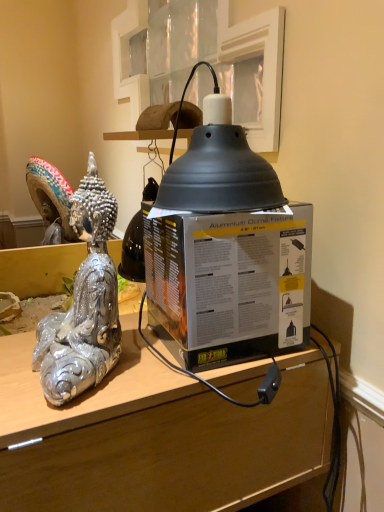
Question: In terms of height, does matte black box at center look taller or shorter compared to shiny silver statue at left?

Choices:
 (A) short
 (B) tall

Answer: (A)

Question: In terms of width, does matte black box at center look wider or thinner when compared to shiny silver statue at left?

Choices:
 (A) wide
 (B) thin

Answer: (A)

Question: Based on their relative distances, which object is farther from the matte black box at center?

Choices:
 (A) matte black box at center
 (B) shiny silver statue at left
 (C) matte black dome at upper center

Answer: (C)

Question: Which is nearer to the matte black box at center?

Choices:
 (A) matte black box at center
 (B) shiny silver statue at left
 (C) matte black dome at upper center

Answer: (A)